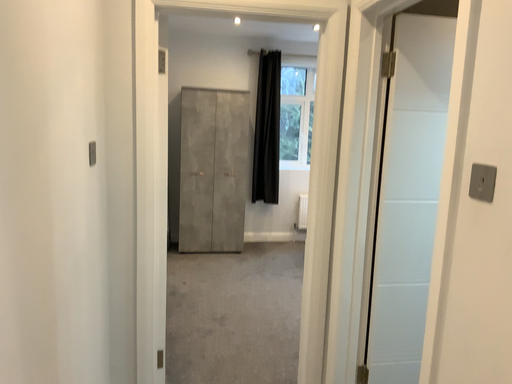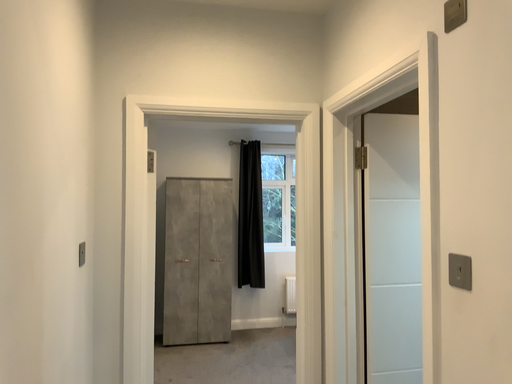
Question: Which way did the camera rotate in the video?

Choices:
 (A) rotated upward
 (B) rotated downward

Answer: (A)